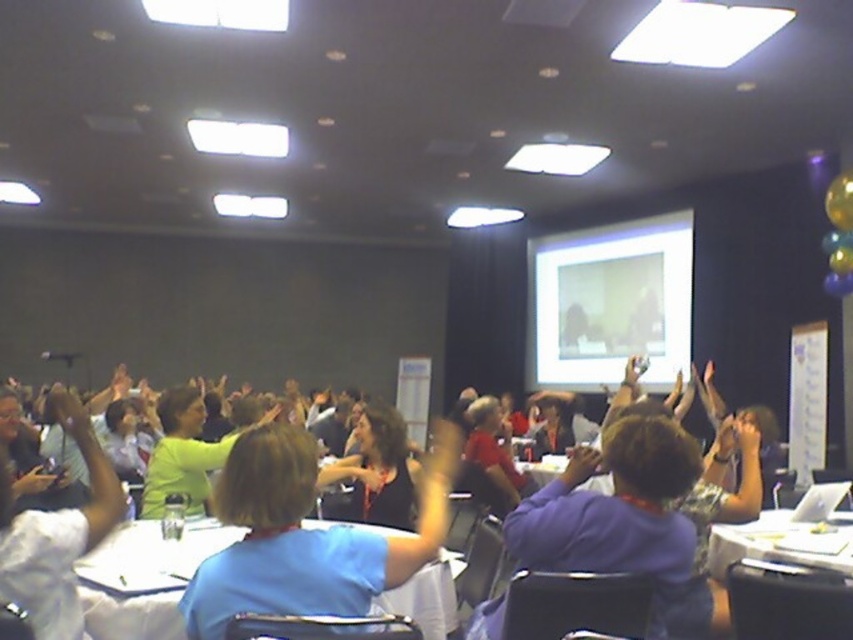
Between point (190, 611) and point (125, 600), which one is positioned behind?

The point (125, 600) is more distant.

Is blue fabric shirt at center smaller than white paper at center?

Actually, blue fabric shirt at center might be larger than white paper at center.

The height and width of the screenshot is (640, 853). Find the location of `blue fabric shirt at center`. blue fabric shirt at center is located at coordinates (305, 536).

Identify the location of blue fabric shirt at center. (305, 536).

Is white paper at center thinner than white plastic table at lower right?

Yes, white paper at center is thinner than white plastic table at lower right.

Find the location of a particular element. white paper at center is located at coordinates (142, 579).

Where is `white paper at center`? The height and width of the screenshot is (640, 853). white paper at center is located at coordinates (142, 579).

Is blue fabric shirt at center further to camera compared to white glossy projector screen at upper center?

No, it is in front of white glossy projector screen at upper center.

Image resolution: width=853 pixels, height=640 pixels. Describe the element at coordinates (305, 536) in the screenshot. I see `blue fabric shirt at center` at that location.

Consider the image. Who is more distant from viewer, (245,586) or (671,372)?

→ Point (671,372)

Where is `blue fabric shirt at center`? This screenshot has width=853, height=640. blue fabric shirt at center is located at coordinates (305, 536).